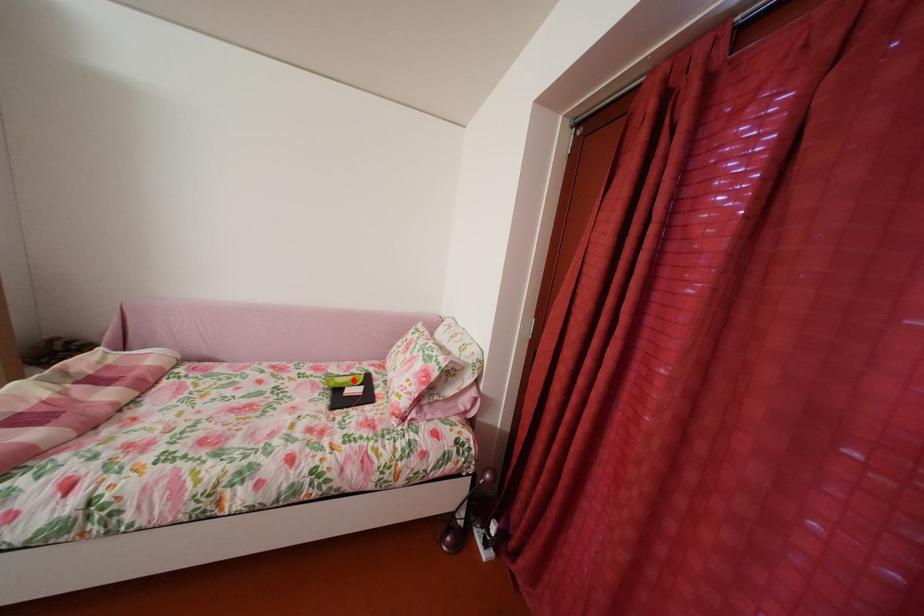
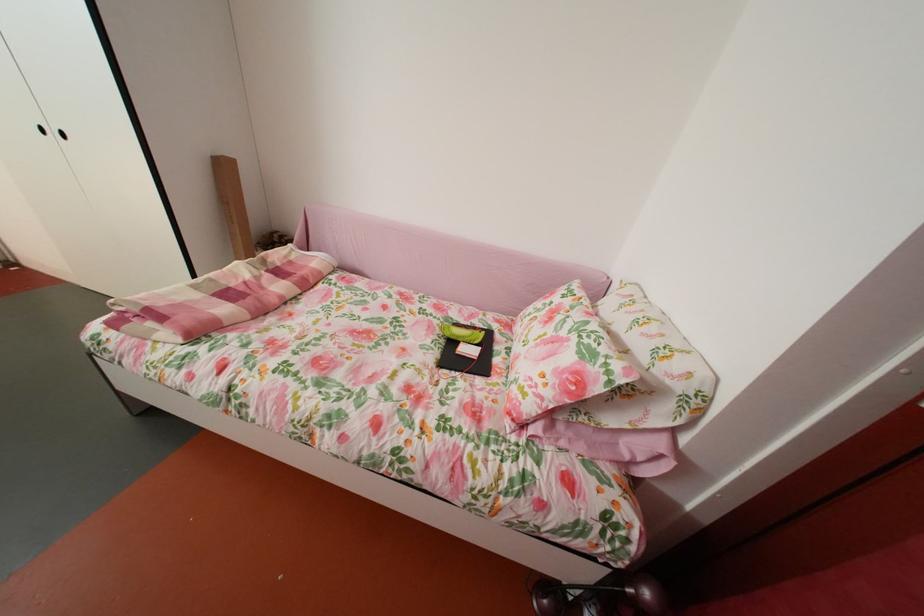
Where in the second image is the point corresponding to the highlighted location from the first image?

(473, 328)